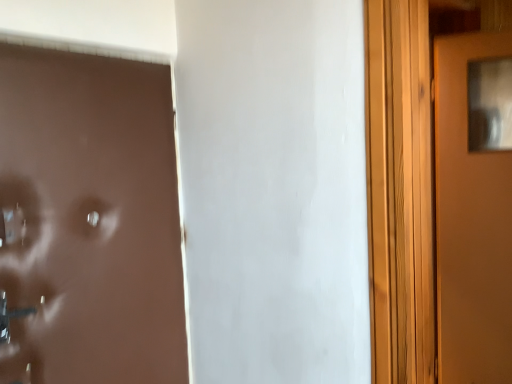
Question: From a real-world perspective, is brown matte door at left, positioned as the first door in front-to-back order, positioned above or below brown matte door at right, marked as the 2th door in a front-to-back arrangement?

Choices:
 (A) above
 (B) below

Answer: (A)

Question: Considering their positions, is brown matte door at left, positioned as the first door in front-to-back order, located in front of or behind brown matte door at right, marked as the 2th door in a front-to-back arrangement?

Choices:
 (A) behind
 (B) front

Answer: (B)

Question: Based on their sizes in the image, would you say brown matte door at left, the 1th door in the left-to-right sequence, is bigger or smaller than brown matte door at right, which is counted as the first door, starting from the right?

Choices:
 (A) small
 (B) big

Answer: (B)

Question: Based on their sizes in the image, would you say brown matte door at right, the 2th door viewed from the left, is bigger or smaller than brown matte door at left, the second door when ordered from back to front?

Choices:
 (A) big
 (B) small

Answer: (B)

Question: Would you say brown matte door at right, marked as the 2th door in a front-to-back arrangement, is inside or outside brown matte door at left, the second door when ordered from back to front?

Choices:
 (A) inside
 (B) outside

Answer: (B)

Question: In terms of width, does brown matte door at right, the first door when ordered from back to front, look wider or thinner when compared to brown matte door at left, the second door when ordered from back to front?

Choices:
 (A) thin
 (B) wide

Answer: (B)

Question: In terms of height, does brown matte door at right, the 2th door viewed from the left, look taller or shorter compared to brown matte door at left, positioned as the first door in front-to-back order?

Choices:
 (A) tall
 (B) short

Answer: (A)